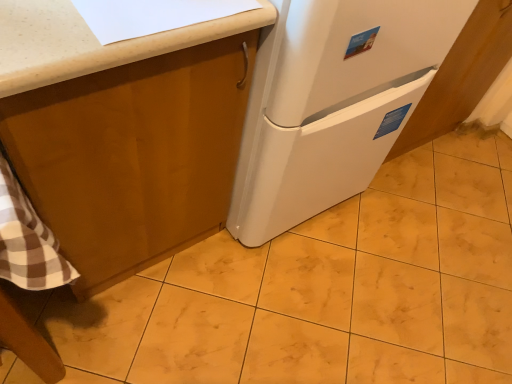
You are a GUI agent. You are given a task and a screenshot of the screen. Output one action in this format:
    pyautogui.click(x=<x>, y=<y>)
    Task: Click on the matte wood cabinet at upper left, marked as the first cabinetry in a left-to-right arrangement
    
    Given the screenshot: What is the action you would take?
    pyautogui.click(x=135, y=153)

In order to face white glossy cabinet at lower right, the 1th cabinetry in the right-to-left sequence, should I rotate leftwards or rightwards?

Turn right by 23.710 degrees to look at white glossy cabinet at lower right, the 1th cabinetry in the right-to-left sequence.

Image resolution: width=512 pixels, height=384 pixels. What are the coordinates of `yellow marble tile at center` in the screenshot? It's located at (325, 290).

Find the location of a particular element. matte wood cabinet at upper left, marked as the first cabinetry in a left-to-right arrangement is located at coordinates (135, 153).

Is point (355, 252) behind point (462, 78)?

Yes, it is.

From the image's perspective, is yellow marble tile at center beneath white glossy cabinet at lower right, arranged as the second cabinetry when viewed from the left?

Yes, from the image's perspective, yellow marble tile at center is below white glossy cabinet at lower right, arranged as the second cabinetry when viewed from the left.

Is yellow marble tile at center bigger or smaller than white glossy cabinet at lower right, the 1th cabinetry in the right-to-left sequence?

Considering their sizes, yellow marble tile at center takes up less space than white glossy cabinet at lower right, the 1th cabinetry in the right-to-left sequence.

Which object is more forward, yellow marble tile at center or white glossy cabinet at lower right, the 1th cabinetry in the right-to-left sequence?

Positioned in front is yellow marble tile at center.

The width and height of the screenshot is (512, 384). There is a white matte refrigerator at center. In order to click on the 1st cabinetry below it (from a real-world perspective) in this screenshot , I will do `click(135, 153)`.

Is matte wood cabinet at upper left, marked as the first cabinetry in a left-to-right arrangement, thinner than white matte refrigerator at center?

Correct, the width of matte wood cabinet at upper left, marked as the first cabinetry in a left-to-right arrangement, is less than that of white matte refrigerator at center.

From the image's perspective, who appears lower, matte wood cabinet at upper left, which ranks as the 2th cabinetry in right-to-left order, or white matte refrigerator at center?

matte wood cabinet at upper left, which ranks as the 2th cabinetry in right-to-left order, is shown below in the image.

Can you confirm if white matte refrigerator at center is bigger than yellow marble tile at center?

Yes, white matte refrigerator at center is bigger than yellow marble tile at center.

Is white matte refrigerator at center further to the viewer compared to yellow marble tile at center?

That is False.

Looking at this image, how distant is white matte refrigerator at center from yellow marble tile at center?

white matte refrigerator at center and yellow marble tile at center are 19.78 inches apart.

Is white matte refrigerator at center aimed at yellow marble tile at center?

Yes.

Considering the sizes of white glossy cabinet at lower right, arranged as the second cabinetry when viewed from the left, and matte wood cabinet at upper left, marked as the first cabinetry in a left-to-right arrangement, in the image, is white glossy cabinet at lower right, arranged as the second cabinetry when viewed from the left, taller or shorter than matte wood cabinet at upper left, marked as the first cabinetry in a left-to-right arrangement,?

Considering their sizes, white glossy cabinet at lower right, arranged as the second cabinetry when viewed from the left, has less height than matte wood cabinet at upper left, marked as the first cabinetry in a left-to-right arrangement.

Is white glossy cabinet at lower right, arranged as the second cabinetry when viewed from the left, looking in the opposite direction of matte wood cabinet at upper left, which ranks as the 2th cabinetry in right-to-left order?

No, white glossy cabinet at lower right, arranged as the second cabinetry when viewed from the left,'s orientation is not away from matte wood cabinet at upper left, which ranks as the 2th cabinetry in right-to-left order.

Between white glossy cabinet at lower right, arranged as the second cabinetry when viewed from the left, and matte wood cabinet at upper left, marked as the first cabinetry in a left-to-right arrangement, which one has smaller width?

white glossy cabinet at lower right, arranged as the second cabinetry when viewed from the left.

Which is more to the right, white matte refrigerator at center or white glossy cabinet at lower right, the 1th cabinetry in the right-to-left sequence?

Positioned to the right is white glossy cabinet at lower right, the 1th cabinetry in the right-to-left sequence.

Between white matte refrigerator at center and white glossy cabinet at lower right, arranged as the second cabinetry when viewed from the left, which one has larger size?

white matte refrigerator at center.

From a real-world perspective, is white matte refrigerator at center positioned over white glossy cabinet at lower right, arranged as the second cabinetry when viewed from the left, based on gravity?

Yes, from a real-world perspective, white matte refrigerator at center is above white glossy cabinet at lower right, arranged as the second cabinetry when viewed from the left.

Choose the correct answer: Is white glossy cabinet at lower right, the 1th cabinetry in the right-to-left sequence, inside yellow marble tile at center or outside it?

The correct answer is: outside.

Which is in front, white glossy cabinet at lower right, arranged as the second cabinetry when viewed from the left, or yellow marble tile at center?

yellow marble tile at center is more forward.

Does white glossy cabinet at lower right, the 1th cabinetry in the right-to-left sequence, have a lesser width compared to yellow marble tile at center?

Yes, white glossy cabinet at lower right, the 1th cabinetry in the right-to-left sequence, is thinner than yellow marble tile at center.

Which of these two, yellow marble tile at center or white matte refrigerator at center, stands taller?

white matte refrigerator at center.

Between yellow marble tile at center and white matte refrigerator at center, which one is positioned behind?

yellow marble tile at center is further from the camera.

Can you confirm if yellow marble tile at center is wider than white matte refrigerator at center?

Yes.

Where is `cabinetry that is behind the yellow marble tile at center`? Image resolution: width=512 pixels, height=384 pixels. cabinetry that is behind the yellow marble tile at center is located at coordinates (461, 76).

At what (x,y) coordinates should I click in order to perform the action: click on cabinetry below the white matte refrigerator at center (from the image's perspective). Please return your answer as a coordinate pair (x, y). Looking at the image, I should click on (x=135, y=153).

When comparing their distances from white glossy cabinet at lower right, the 1th cabinetry in the right-to-left sequence, does white matte refrigerator at center or matte wood cabinet at upper left, marked as the first cabinetry in a left-to-right arrangement, seem further?

Based on the image, matte wood cabinet at upper left, marked as the first cabinetry in a left-to-right arrangement, appears to be further to white glossy cabinet at lower right, the 1th cabinetry in the right-to-left sequence.

Looking at this image, estimate the real-world distances between objects in this image. Which object is further from white matte refrigerator at center, matte wood cabinet at upper left, marked as the first cabinetry in a left-to-right arrangement, or yellow marble tile at center?

Based on the image, yellow marble tile at center appears to be further to white matte refrigerator at center.

When comparing their distances from white glossy cabinet at lower right, the 1th cabinetry in the right-to-left sequence, does white matte refrigerator at center or yellow marble tile at center seem further?

Among the two, yellow marble tile at center is located further to white glossy cabinet at lower right, the 1th cabinetry in the right-to-left sequence.

From the image, which object appears to be nearer to yellow marble tile at center, white glossy cabinet at lower right, the 1th cabinetry in the right-to-left sequence, or white matte refrigerator at center?

white matte refrigerator at center.

Looking at the image, which one is located closer to yellow marble tile at center, white glossy cabinet at lower right, arranged as the second cabinetry when viewed from the left, or matte wood cabinet at upper left, which ranks as the 2th cabinetry in right-to-left order?

matte wood cabinet at upper left, which ranks as the 2th cabinetry in right-to-left order.

When comparing their distances from yellow marble tile at center, does matte wood cabinet at upper left, marked as the first cabinetry in a left-to-right arrangement, or white matte refrigerator at center seem further?

matte wood cabinet at upper left, marked as the first cabinetry in a left-to-right arrangement, lies further to yellow marble tile at center than the other object.

Considering their positions, is white glossy cabinet at lower right, the 1th cabinetry in the right-to-left sequence, positioned further to matte wood cabinet at upper left, marked as the first cabinetry in a left-to-right arrangement, than yellow marble tile at center?

white glossy cabinet at lower right, the 1th cabinetry in the right-to-left sequence, is further to matte wood cabinet at upper left, marked as the first cabinetry in a left-to-right arrangement.

Considering their positions, is yellow marble tile at center positioned further to white glossy cabinet at lower right, arranged as the second cabinetry when viewed from the left, than matte wood cabinet at upper left, which ranks as the 2th cabinetry in right-to-left order?

matte wood cabinet at upper left, which ranks as the 2th cabinetry in right-to-left order.

You are a GUI agent. You are given a task and a screenshot of the screen. Output one action in this format:
    pyautogui.click(x=<x>, y=<y>)
    Task: Click on the refrigerator between matte wood cabinet at upper left, which ranks as the 2th cabinetry in right-to-left order, and yellow marble tile at center from left to right
    
    Given the screenshot: What is the action you would take?
    pyautogui.click(x=332, y=104)

Locate an element on the screen. The height and width of the screenshot is (384, 512). refrigerator between white glossy cabinet at lower right, the 1th cabinetry in the right-to-left sequence, and yellow marble tile at center from top to bottom is located at coordinates (332, 104).

Where is `refrigerator between matte wood cabinet at upper left, marked as the first cabinetry in a left-to-right arrangement, and white glossy cabinet at lower right, arranged as the second cabinetry when viewed from the left`? refrigerator between matte wood cabinet at upper left, marked as the first cabinetry in a left-to-right arrangement, and white glossy cabinet at lower right, arranged as the second cabinetry when viewed from the left is located at coordinates (332, 104).

The height and width of the screenshot is (384, 512). What are the coordinates of `tile situated between matte wood cabinet at upper left, marked as the first cabinetry in a left-to-right arrangement, and white glossy cabinet at lower right, arranged as the second cabinetry when viewed from the left, from left to right` in the screenshot? It's located at (325, 290).